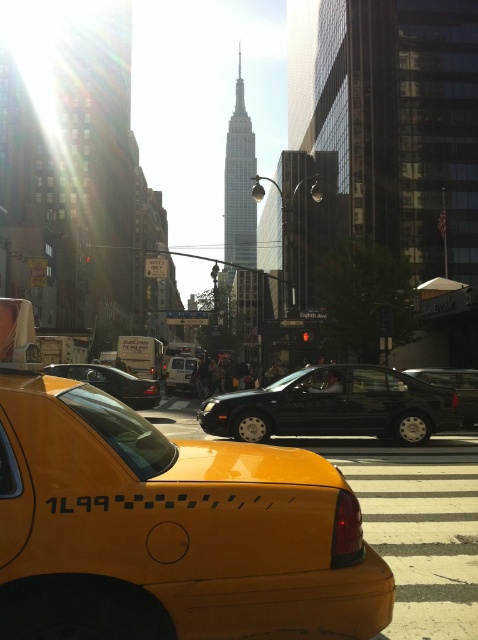
You are standing at the point marked by the coordinate point at (165,524) in the image. What object are you directly in front of?

The point at (165,524) marks the yellow plastic taxi at center, so you are directly in front of the yellow plastic taxi at center.

You are a delivery person who needs to load a large package into either the yellow plastic taxi at center or the black rubber sedan at center. Which vehicle should you choose based on height requirements?

The yellow plastic taxi at center is much taller than the black rubber sedan at center, so you should choose the yellow plastic taxi at center to load the large package.